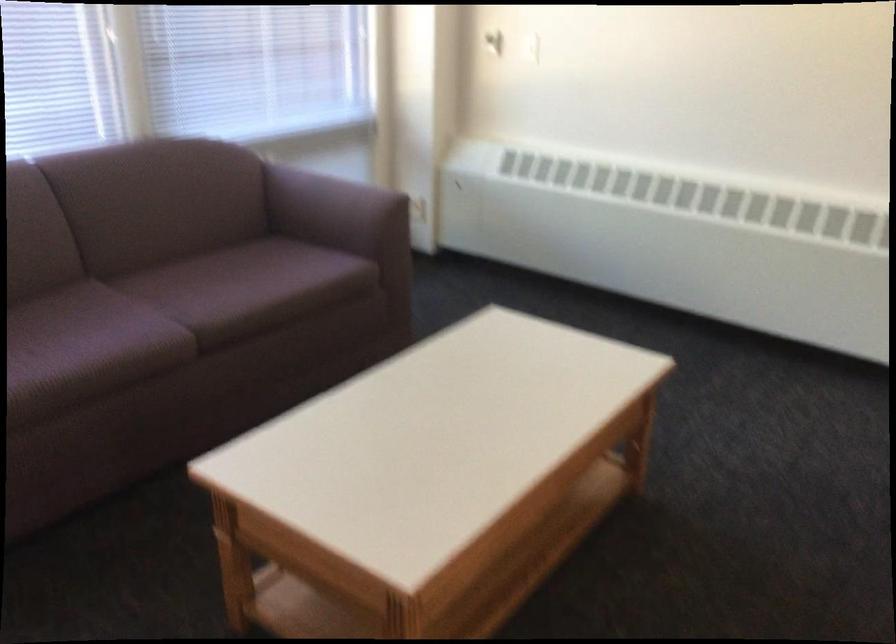
Where would you sitting on the sofa sitting surface? Please return your answer as a coordinate pair (x, y).

(168, 316)